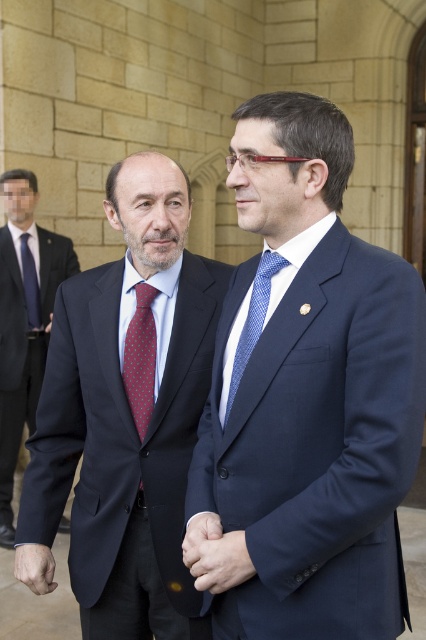
Does blue textured suit at center have a lesser height compared to matte black hand at center?

In fact, blue textured suit at center may be taller than matte black hand at center.

Can you confirm if blue textured suit at center is bigger than matte black hand at center?

Yes, blue textured suit at center is bigger than matte black hand at center.

Who is more distant from viewer, (308, 129) or (227, 586)?

Point (308, 129)

Locate an element on the screen. Image resolution: width=426 pixels, height=640 pixels. blue textured suit at center is located at coordinates (310, 392).

Can you confirm if matte black suit at center is thinner than red dotted tie at left?

No.

Is matte black suit at center to the left of red dotted tie at left from the viewer's perspective?

Incorrect, matte black suit at center is not on the left side of red dotted tie at left.

What do you see at coordinates (23, 321) in the screenshot? Image resolution: width=426 pixels, height=640 pixels. I see `matte black suit at center` at bounding box center [23, 321].

Find the location of a particular element. The height and width of the screenshot is (640, 426). matte black suit at center is located at coordinates (23, 321).

Is blue textured suit at center above red dotted tie at center?

Correct, blue textured suit at center is located above red dotted tie at center.

Who is shorter, blue textured suit at center or red dotted tie at center?

red dotted tie at center

Does point (307, 273) come farther from viewer compared to point (135, 413)?

That is False.

The width and height of the screenshot is (426, 640). I want to click on blue textured suit at center, so click(x=310, y=392).